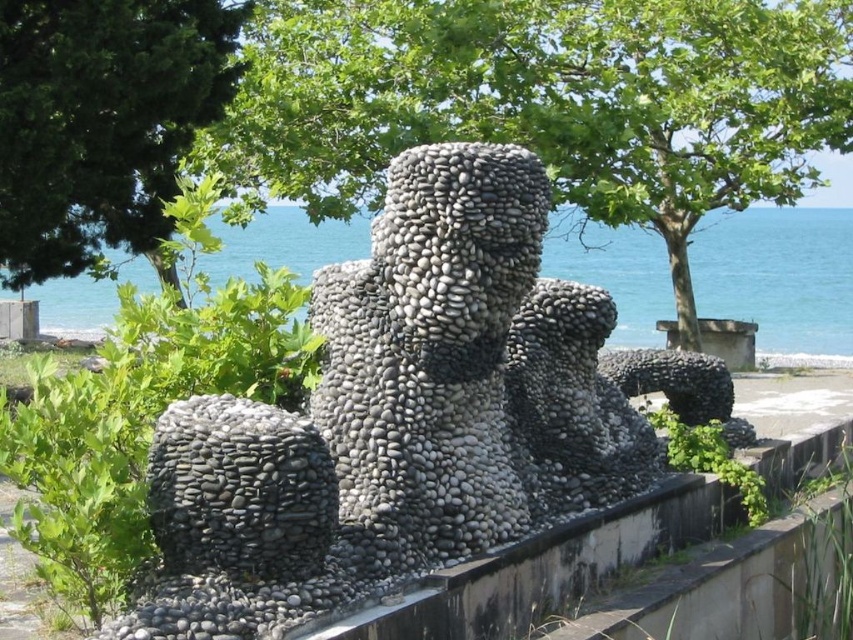
You are an artist planning to install a new sculpture in the same area as the gray pebble statue at center and the smooth concrete ledge at center. If you want to ensure your new sculpture is taller than both existing objects, what minimum height must it have?

The gray pebble statue at center is taller than the smooth concrete ledge at center. Therefore, your new sculpture must be taller than the gray pebble statue at center to surpass both. The exact minimum height isn not provided, but it needs to exceed the height of the gray pebble statue at center.

You are standing in front of the sculpture and want to step onto the smooth concrete ledge at center. Is the blue water at center between you and the ledge?

Yes, the blue water at center is between you and the smooth concrete ledge at center because the water is closer to the viewer than the ledge.